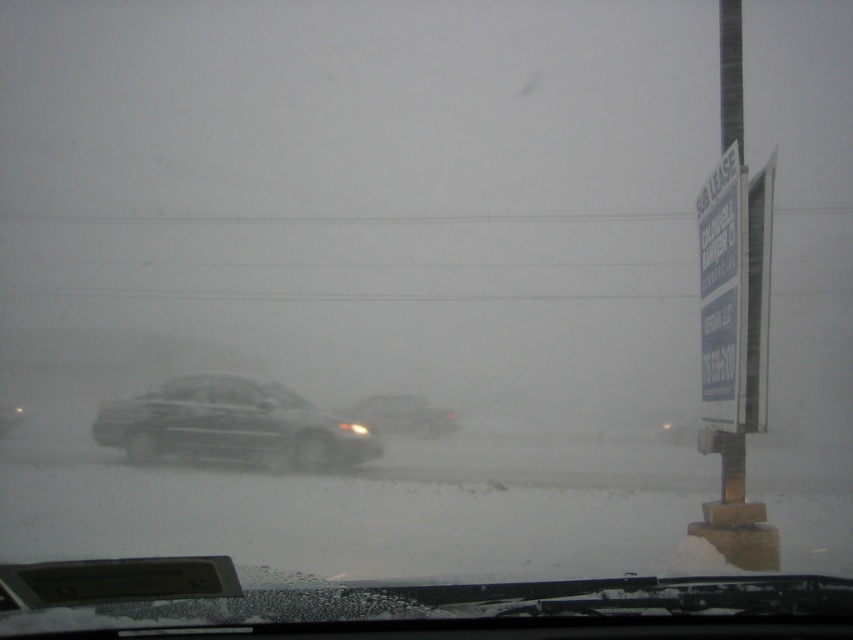
Is point (115, 422) less distant than point (720, 172)?

No, it is not.

Can you confirm if sleek metallic sedan at center is taller than white paper sign at right?

No, sleek metallic sedan at center is not taller than white paper sign at right.

Locate an element on the screen. sleek metallic sedan at center is located at coordinates (231, 424).

Is point (734, 378) farther from viewer compared to point (412, 403)?

That is False.

Can you confirm if white paper sign at right is shorter than matte black car at center?

In fact, white paper sign at right may be taller than matte black car at center.

Where is `white paper sign at right`? white paper sign at right is located at coordinates (722, 291).

From the picture: Which is more to the left, sleek metallic sedan at center or matte black car at center?

sleek metallic sedan at center is more to the left.

Does sleek metallic sedan at center have a greater height compared to matte black car at center?

Yes, sleek metallic sedan at center is taller than matte black car at center.

Image resolution: width=853 pixels, height=640 pixels. What do you see at coordinates (231, 424) in the screenshot? I see `sleek metallic sedan at center` at bounding box center [231, 424].

Locate an element on the screen. sleek metallic sedan at center is located at coordinates (231, 424).